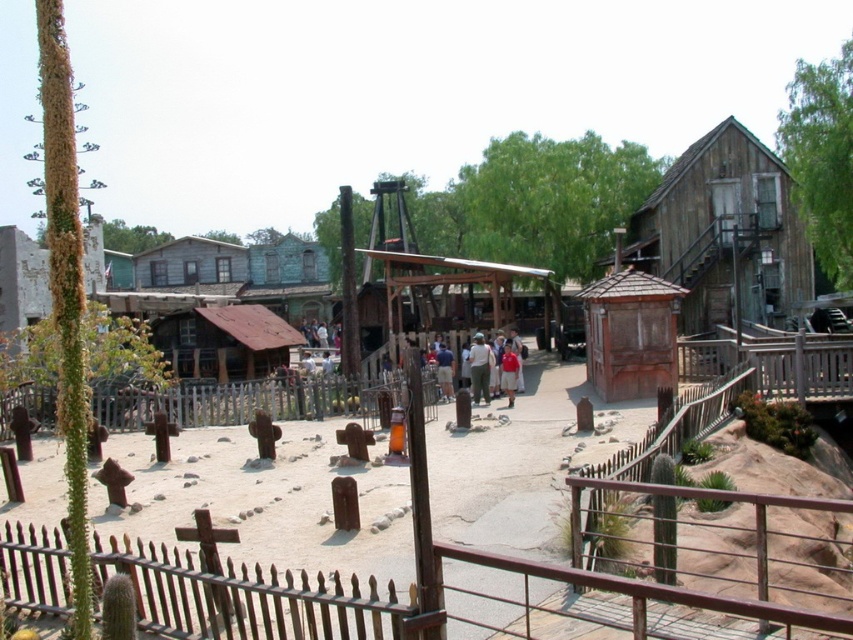
Question: Among these points, which one is farthest from the camera?

Choices:
 (A) (511, 372)
 (B) (740, 196)

Answer: (B)

Question: Is brown wooden fence at lower center further to the viewer compared to weathered wood cabin at upper right?

Choices:
 (A) yes
 (B) no

Answer: (B)

Question: Is matte white shirt at center bigger than light blue shirt at center?

Choices:
 (A) yes
 (B) no

Answer: (A)

Question: Which of these objects is positioned closest to the wooden picket fence at center?

Choices:
 (A) matte white shirt at center
 (B) light blue shirt at center
 (C) weathered wood cabin at upper right
 (D) red matte shirt at center

Answer: (B)

Question: Is weathered wood cabin at upper right positioned behind red matte shirt at center?

Choices:
 (A) no
 (B) yes

Answer: (A)

Question: Considering the real-world distances, which object is closest to the wooden picket fence at center?

Choices:
 (A) weathered wood cabin at upper right
 (B) brown wooden fence at lower center

Answer: (B)